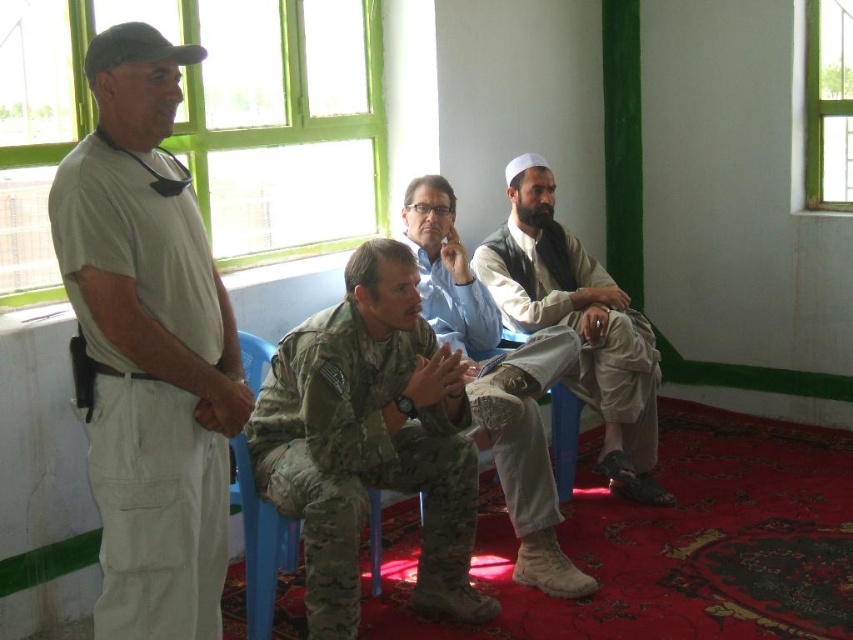
This screenshot has width=853, height=640. I want to click on camouflage fabric uniform at center, so point(360,458).

Can you confirm if camouflage fabric uniform at center is shorter than camouflage uniform pants at center?

Correct, camouflage fabric uniform at center is not as tall as camouflage uniform pants at center.

Does point (428, 584) come behind point (451, 244)?

No.

Identify the location of camouflage fabric uniform at center. The height and width of the screenshot is (640, 853). (360, 458).

Who is lower down, matte khaki uniform at left or beige fabric vest at center?

matte khaki uniform at left

Is matte khaki uniform at left further to the viewer compared to beige fabric vest at center?

No.

This screenshot has height=640, width=853. Identify the location of matte khaki uniform at left. (148, 346).

Does matte khaki uniform at left have a smaller size compared to camouflage fabric uniform at center?

Indeed, matte khaki uniform at left has a smaller size compared to camouflage fabric uniform at center.

Between matte khaki uniform at left and camouflage fabric uniform at center, which one is positioned lower?

camouflage fabric uniform at center is lower down.

Locate an element on the screen. matte khaki uniform at left is located at coordinates (148, 346).